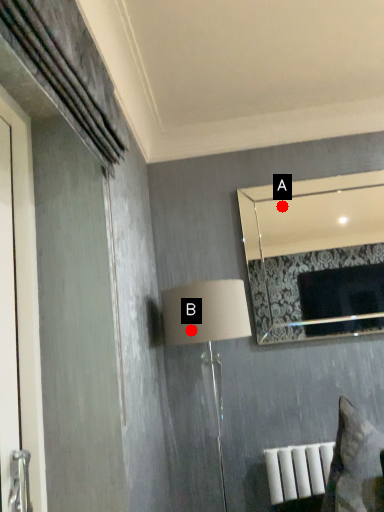
Question: Two points are circled on the image, labeled by A and B beside each circle. Which of the following is the closest to the observer?

Choices:
 (A) A is closer
 (B) B is closer

Answer: (B)